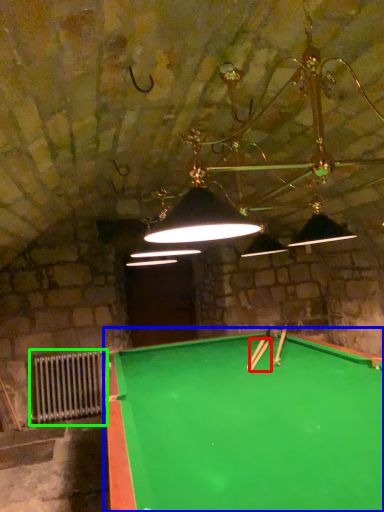
Question: Considering the real-world distances, which object is closest to cue (highlighted by a red box)? billiard table (highlighted by a blue box) or radiator (highlighted by a green box).

Choices:
 (A) billiard table
 (B) radiator

Answer: (A)